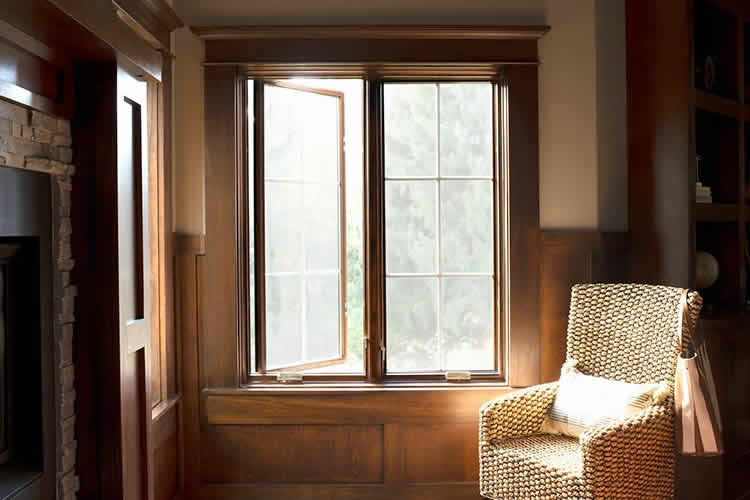
Where is `pillow`? Image resolution: width=750 pixels, height=500 pixels. pillow is located at coordinates (618, 397).